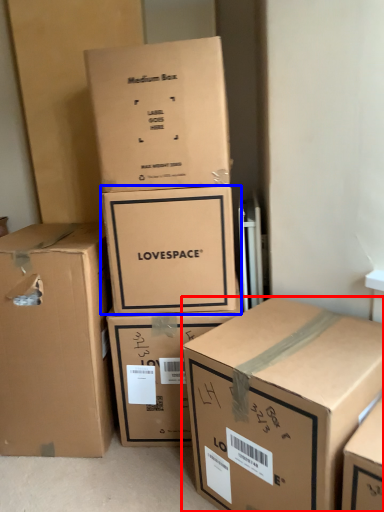
Question: Among these objects, which one is nearest to the camera, box (highlighted by a red box) or box (highlighted by a blue box)?

Choices:
 (A) box
 (B) box

Answer: (A)